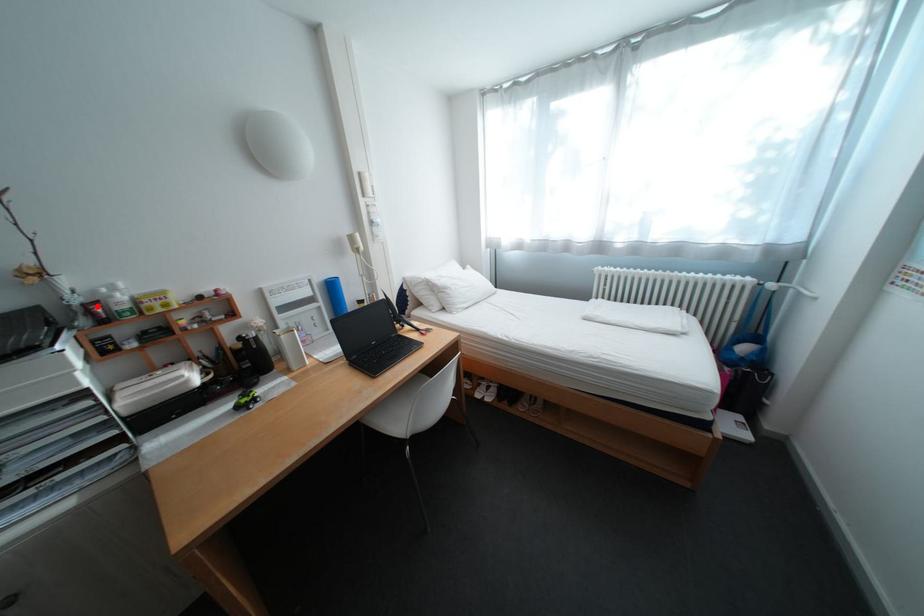
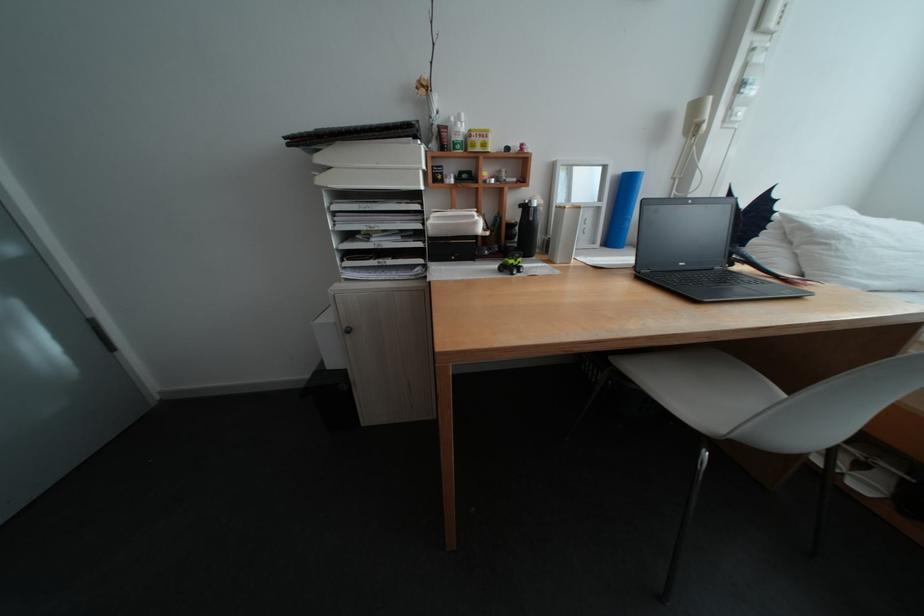
In the second image, find the point that corresponds to the highlighted location in the first image.

(453, 128)